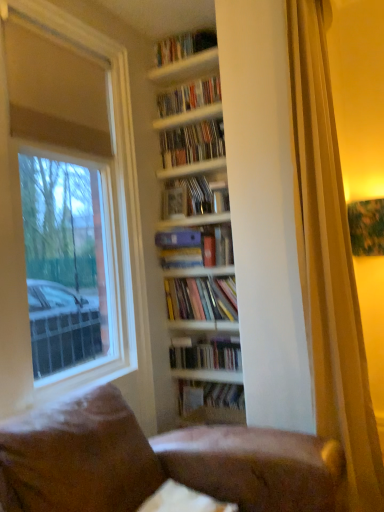
I want to click on blank space above hardcover books at upper center, the eighth book from the bottom (from a real-world perspective), so pos(183,33).